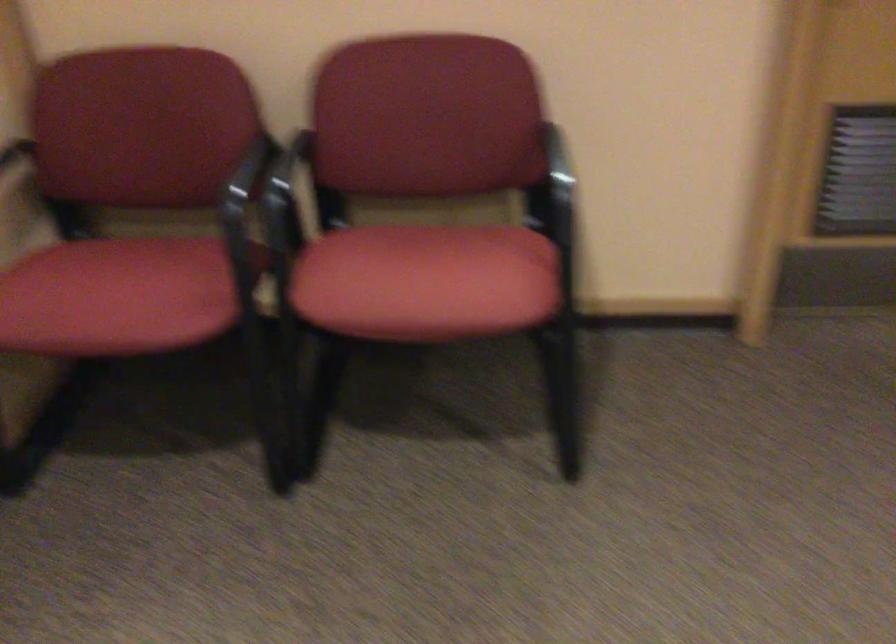
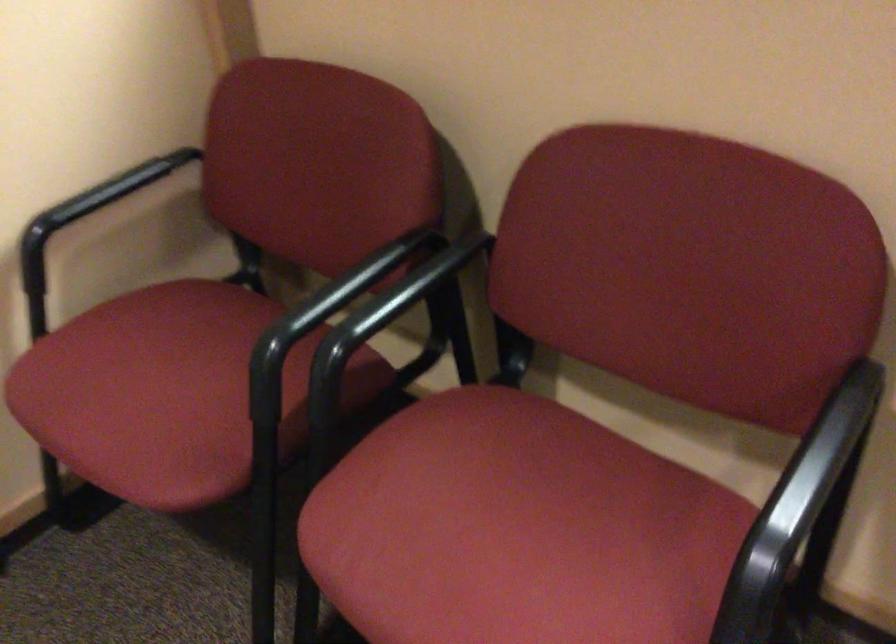
Question: The camera is either moving clockwise (left) or counter-clockwise (right) around the object. The first image is from the beginning of the video and the second image is from the end. Is the camera moving left or right when shooting the video?

Choices:
 (A) Left
 (B) Right

Answer: (B)